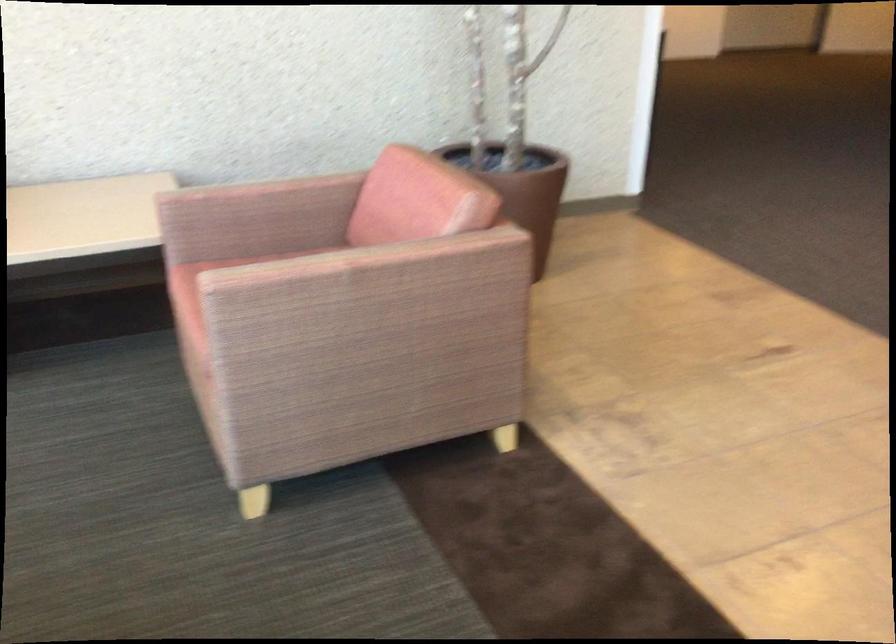
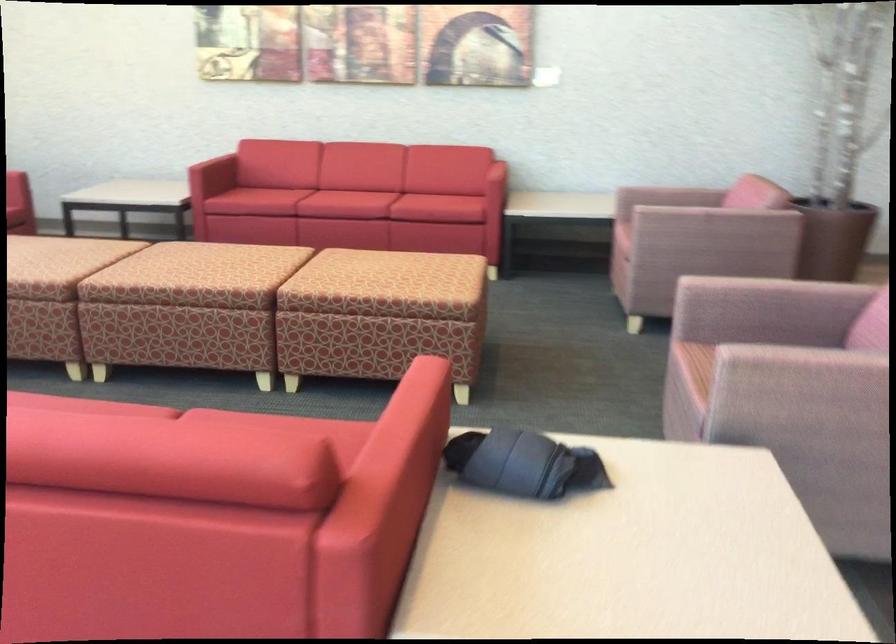
Find the pixel in the second image that matches (270,234) in the first image.

(669, 196)